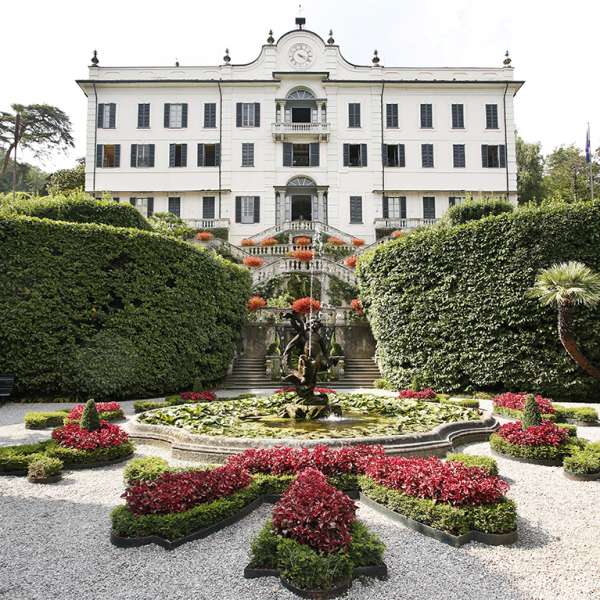
At what (x,y) coordinates should I click in order to perform the action: click on stairs. Please return your answer as a coordinate pair (x, y). Looking at the image, I should click on (357, 375), (360, 365), (360, 348), (359, 337).